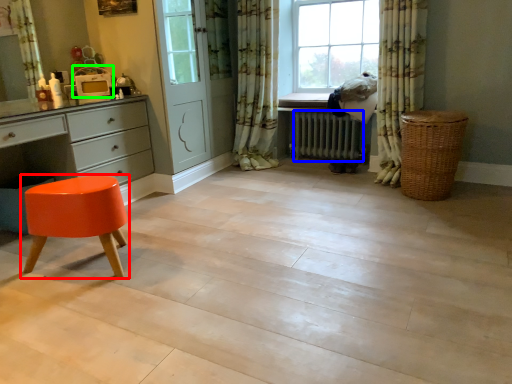
Question: Based on their relative distances, which object is farther from stool (highlighted by a red box)? Choose from radiator (highlighted by a blue box) and appliance (highlighted by a green box).

Choices:
 (A) radiator
 (B) appliance

Answer: (A)